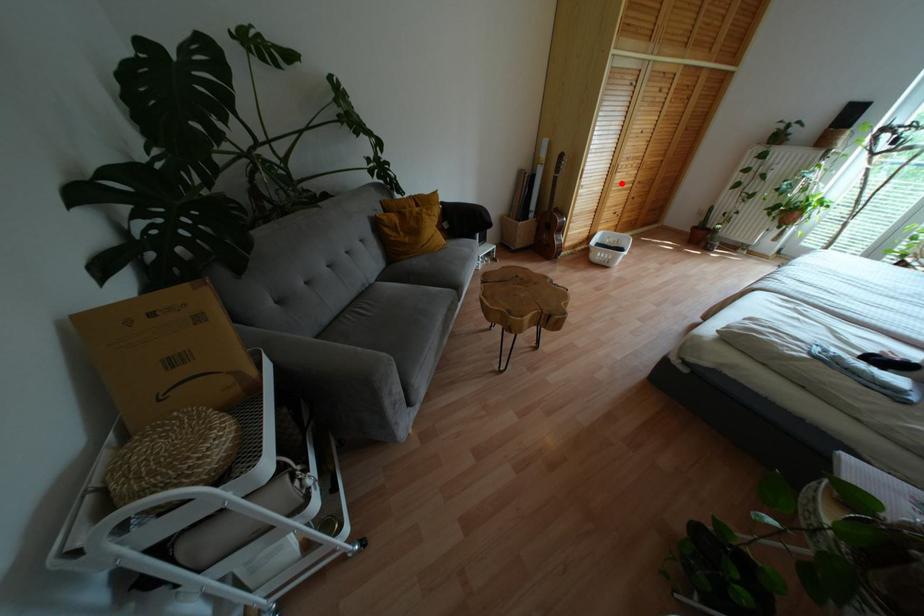
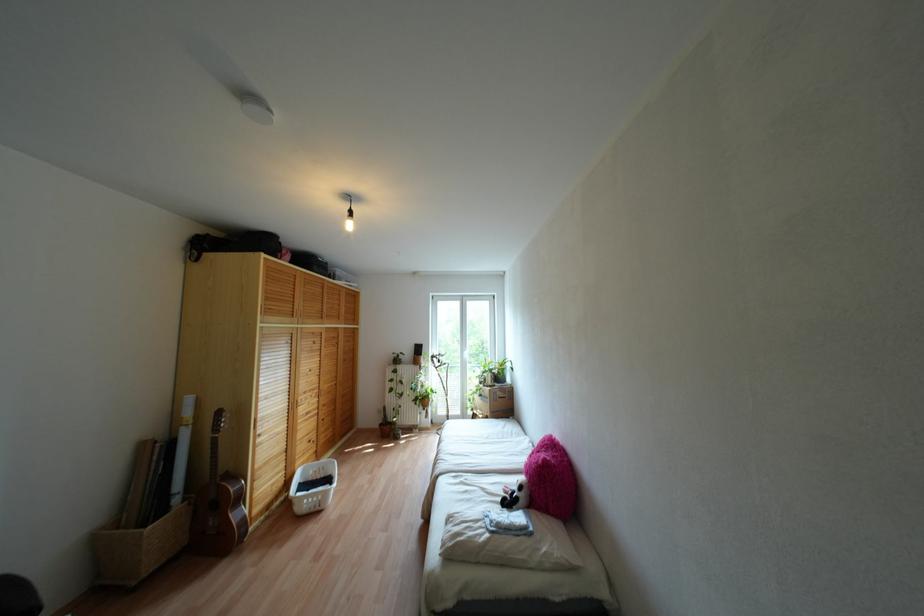
Find the pixel in the second image that matches the highlighted location in the first image.

(307, 413)